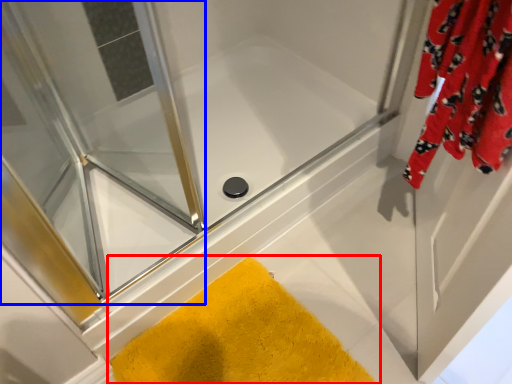
Question: Which object appears closest to the camera in this image, bath mat (highlighted by a red box) or screen door (highlighted by a blue box)?

Choices:
 (A) bath mat
 (B) screen door

Answer: (B)